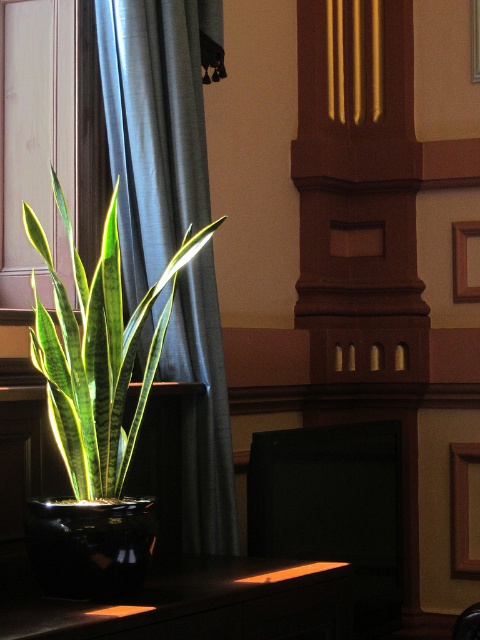
Looking at this image, who is higher up, green glossy snake plant at left or black glossy table at lower center?

green glossy snake plant at left

Does green glossy snake plant at left appear over black glossy table at lower center?

Indeed, green glossy snake plant at left is positioned over black glossy table at lower center.

Is point (72, 244) in front of point (325, 632)?

Yes, point (72, 244) is closer to viewer.

The width and height of the screenshot is (480, 640). I want to click on green glossy snake plant at left, so [97, 353].

Between black glossy table at lower center and wooden picture frame at upper center, which one appears on the left side from the viewer's perspective?

Positioned to the left is black glossy table at lower center.

Locate an element on the screen. This screenshot has height=640, width=480. black glossy table at lower center is located at coordinates (203, 605).

Image resolution: width=480 pixels, height=640 pixels. Identify the location of black glossy table at lower center. (x=203, y=605).

Which is in front, point (84, 314) or point (467, 461)?

Point (84, 314) is in front.

Is point (87, 486) positioned before point (469, 566)?

That is True.

Identify the location of green glossy snake plant at left. The width and height of the screenshot is (480, 640). (97, 353).